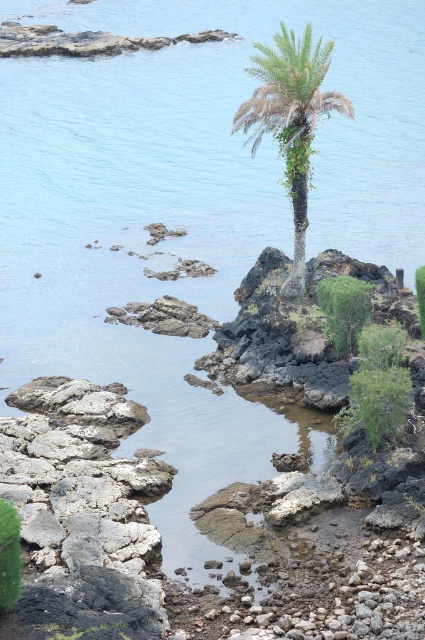
Question: Is gray rough rock at lower left closer to camera compared to brown textured palm tree at center?

Choices:
 (A) no
 (B) yes

Answer: (B)

Question: Which of the following is the closest to the observer?

Choices:
 (A) (119, 577)
 (B) (289, 166)

Answer: (A)

Question: Can you confirm if gray rough rock at lower left is wider than brown textured palm tree at center?

Choices:
 (A) yes
 (B) no

Answer: (A)

Question: Is gray rough rock at lower left to the left of brown textured palm tree at center from the viewer's perspective?

Choices:
 (A) no
 (B) yes

Answer: (B)